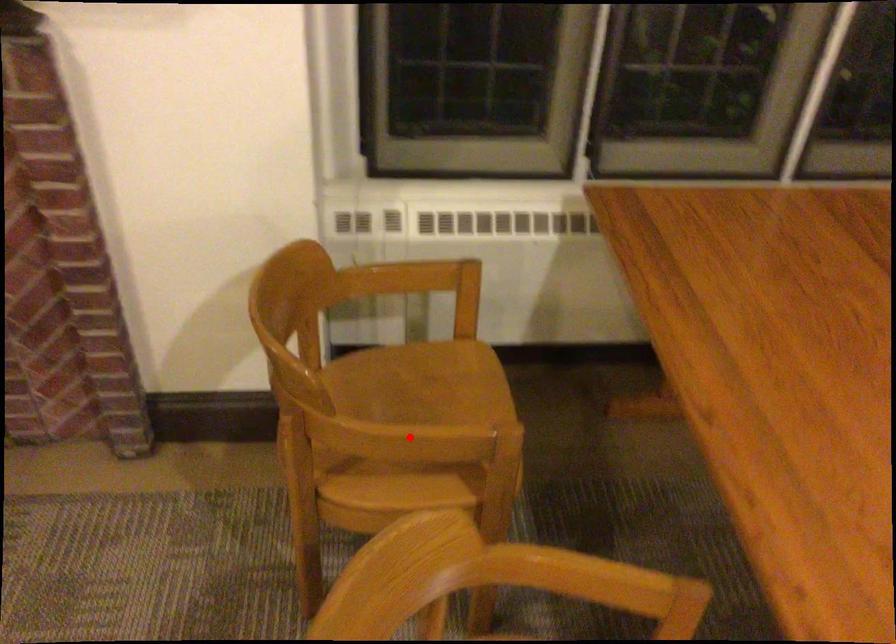
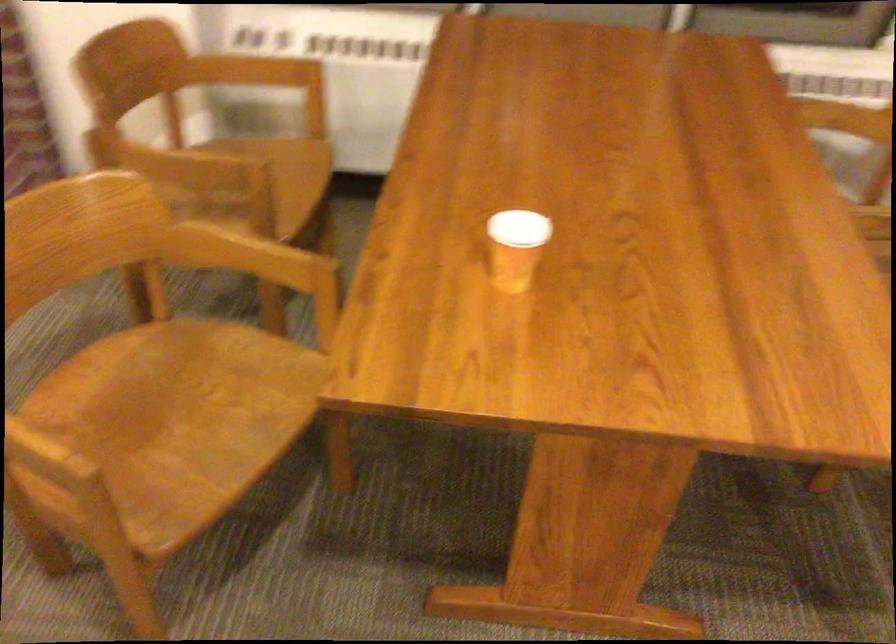
The point at the highlighted location is marked in the first image. Where is the corresponding point in the second image?

(169, 163)